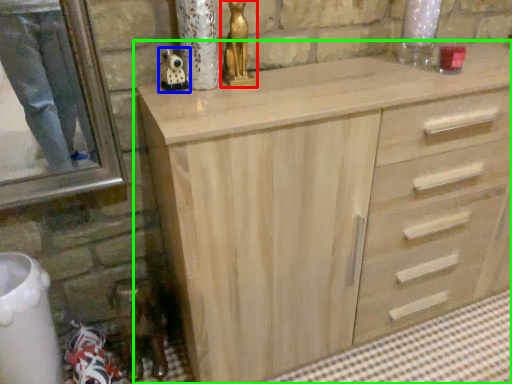
Question: Which object is the farthest from sculpture (highlighted by a red box)? Choose among these: miniature (highlighted by a blue box) or chest of drawers (highlighted by a green box).

Choices:
 (A) miniature
 (B) chest of drawers

Answer: (B)